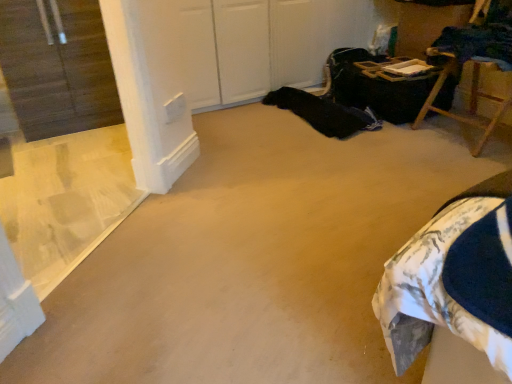
Locate an element on the screen. This screenshot has height=384, width=512. free area below wooden folding chair at upper right (from a real-world perspective) is located at coordinates (456, 130).